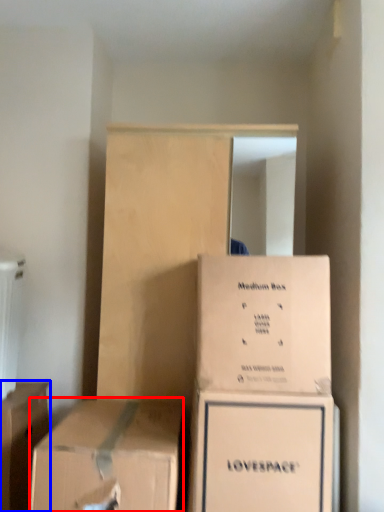
Question: Among these objects, which one is farthest to the camera, box (highlighted by a red box) or box (highlighted by a blue box)?

Choices:
 (A) box
 (B) box

Answer: (B)